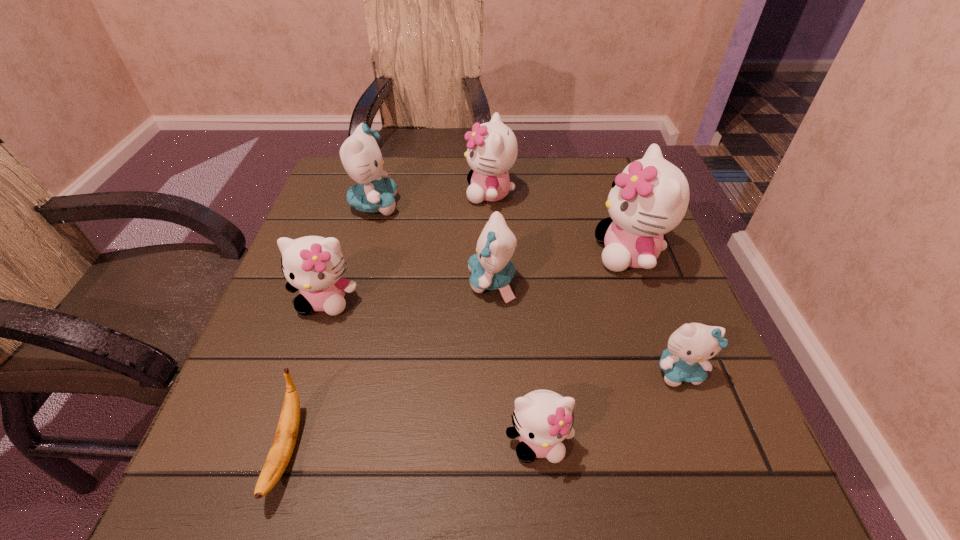
Where is `the closest kitten relative to the yellow banana`? The height and width of the screenshot is (540, 960). the closest kitten relative to the yellow banana is located at coordinates (313, 264).

Identify the location of white kitten identified as the third closest to the farthest blue kitten. This screenshot has width=960, height=540. (650, 197).

At what (x,y) coordinates should I click in order to perform the action: click on white kitten object that ranks as the third closest to the second biggest white kitten. Please return your answer as a coordinate pair (x, y). The image size is (960, 540). Looking at the image, I should click on (542, 419).

The width and height of the screenshot is (960, 540). In order to click on blue kitten that is the closest to the farthest white kitten in this screenshot , I will do `click(360, 154)`.

Identify which blue kitten is the nearest to the banana. Please provide its 2D coordinates. Your answer should be formatted as a tuple, i.e. [(x, y)], where the tuple contains the x and y coordinates of a point satisfying the conditions above.

[(491, 268)]

This screenshot has width=960, height=540. Identify the location of free space that satisfies the following two spatial constraints: 1. on the front-facing side of the farthest white kitten; 2. on the front-facing side of the second smallest white kitten. (493, 300).

Find the location of a particular element. Image resolution: width=960 pixels, height=540 pixels. vacant space that satisfies the following two spatial constraints: 1. on the front-facing side of the second biggest white kitten; 2. on the front-facing side of the second smallest white kitten is located at coordinates (493, 300).

The image size is (960, 540). In order to click on vacant region that satisfies the following two spatial constraints: 1. on the face of the leftmost blue kitten; 2. on the front-facing side of the leftmost white kitten in this screenshot , I will do `click(348, 300)`.

Locate an element on the screen. Image resolution: width=960 pixels, height=540 pixels. vacant space that satisfies the following two spatial constraints: 1. on the face of the farthest blue kitten; 2. on the peel of the yellow banana from the top is located at coordinates (304, 450).